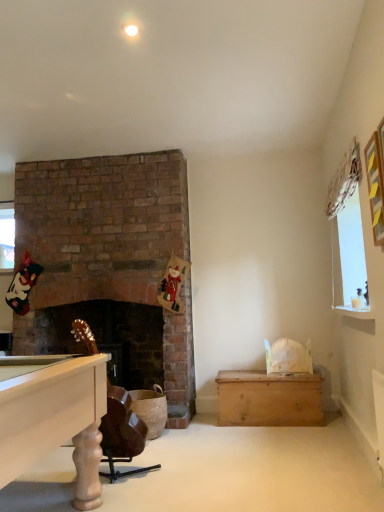
Question: Could you tell me if wooden chest at lower right is facing brown leather rocking chair at lower left?

Choices:
 (A) yes
 (B) no

Answer: (A)

Question: Is wooden chest at lower right not near brown leather rocking chair at lower left?

Choices:
 (A) yes
 (B) no

Answer: (A)

Question: Can you see wooden chest at lower right touching brown leather rocking chair at lower left?

Choices:
 (A) no
 (B) yes

Answer: (A)

Question: From a real-world perspective, is wooden chest at lower right under brown leather rocking chair at lower left?

Choices:
 (A) no
 (B) yes

Answer: (B)

Question: Considering the relative sizes of wooden chest at lower right and brown leather rocking chair at lower left in the image provided, is wooden chest at lower right smaller than brown leather rocking chair at lower left?

Choices:
 (A) no
 (B) yes

Answer: (A)

Question: Is wooden chest at lower right outside of brown leather rocking chair at lower left?

Choices:
 (A) yes
 (B) no

Answer: (A)

Question: Is wooden chest at lower right beside yellow paper picture frame at upper right?

Choices:
 (A) yes
 (B) no

Answer: (B)

Question: Is wooden chest at lower right bigger than yellow paper picture frame at upper right?

Choices:
 (A) yes
 (B) no

Answer: (A)

Question: Does wooden chest at lower right have a lesser height compared to yellow paper picture frame at upper right?

Choices:
 (A) no
 (B) yes

Answer: (B)

Question: Considering the relative sizes of wooden chest at lower right and yellow paper picture frame at upper right in the image provided, is wooden chest at lower right thinner than yellow paper picture frame at upper right?

Choices:
 (A) no
 (B) yes

Answer: (A)

Question: Can you confirm if wooden chest at lower right is wider than yellow paper picture frame at upper right?

Choices:
 (A) yes
 (B) no

Answer: (A)

Question: Can you confirm if wooden chest at lower right is positioned to the right of yellow paper picture frame at upper right?

Choices:
 (A) no
 (B) yes

Answer: (A)

Question: Is brown leather rocking chair at lower left oriented away from yellow paper picture frame at upper right?

Choices:
 (A) no
 (B) yes

Answer: (A)